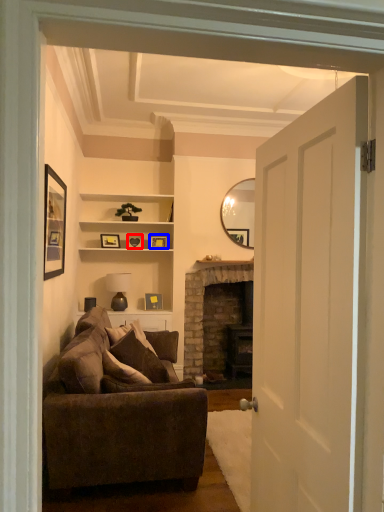
Question: Which point is closer to the camera, picture frame (highlighted by a red box) or picture frame (highlighted by a blue box)?

Choices:
 (A) picture frame
 (B) picture frame

Answer: (A)